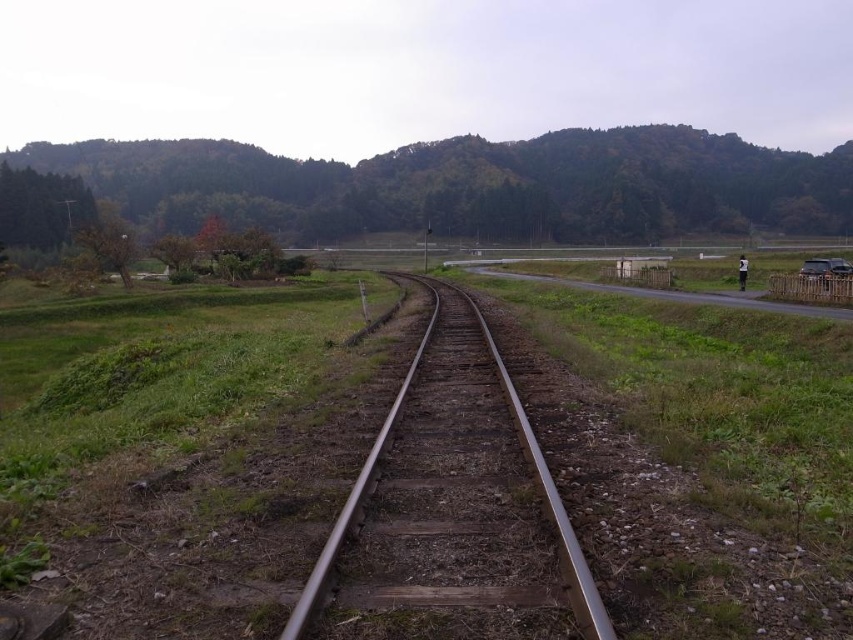
Question: Is metal/smooth track at center behind metallic silver car at right?

Choices:
 (A) yes
 (B) no

Answer: (B)

Question: Which of the following is the closest to the observer?

Choices:
 (A) (340, 572)
 (B) (804, 273)

Answer: (A)

Question: Can you confirm if metal/smooth track at center is positioned above metallic silver car at right?

Choices:
 (A) yes
 (B) no

Answer: (B)

Question: Is metal/smooth track at center positioned behind metallic silver car at right?

Choices:
 (A) no
 (B) yes

Answer: (A)